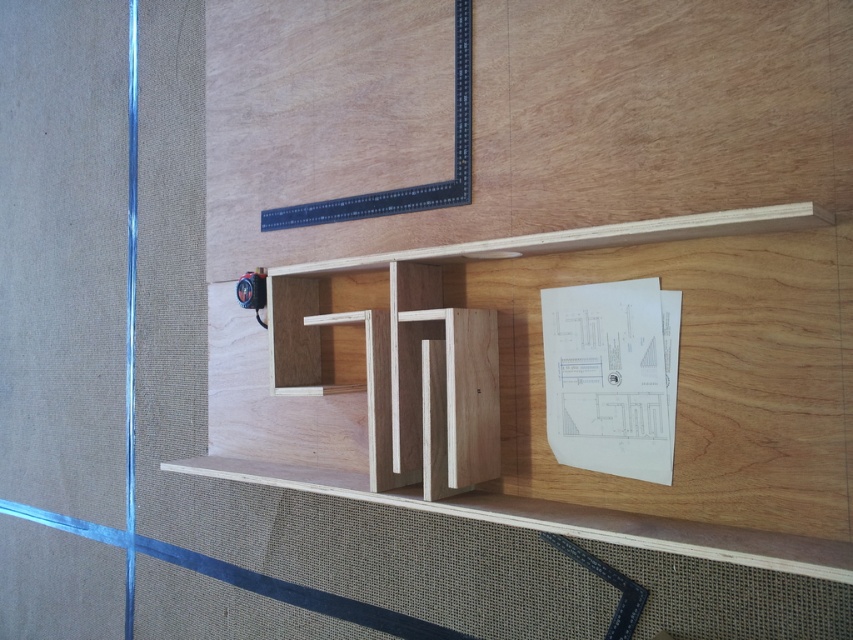
Question: Can you confirm if natural wood shelf at center is positioned to the right of transparent glass door at left?

Choices:
 (A) no
 (B) yes

Answer: (B)

Question: Among these objects, which one is nearest to the camera?

Choices:
 (A) transparent glass door at left
 (B) natural wood shelf at center

Answer: (B)

Question: Where is natural wood shelf at center located in relation to transparent glass door at left in the image?

Choices:
 (A) above
 (B) below

Answer: (B)

Question: Can you confirm if natural wood shelf at center is thinner than transparent glass door at left?

Choices:
 (A) yes
 (B) no

Answer: (B)